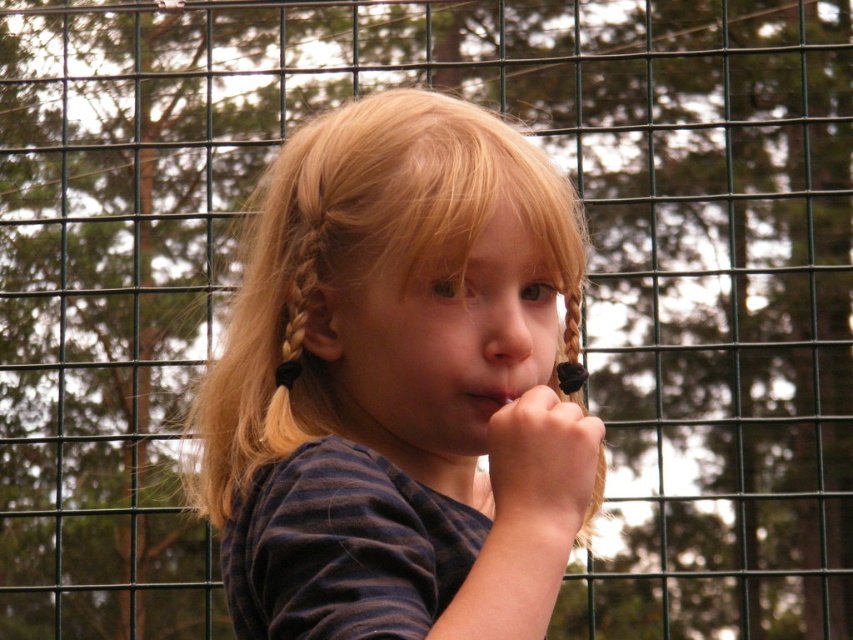
The child in the image is holding their hand near their mouth. Based on the spatial relationship between the smooth skin hand at center and the matte pink lips at center, is the hand positioned above or below the lips?

The smooth skin hand at center is located below matte pink lips at center, so the hand is positioned below the lips.